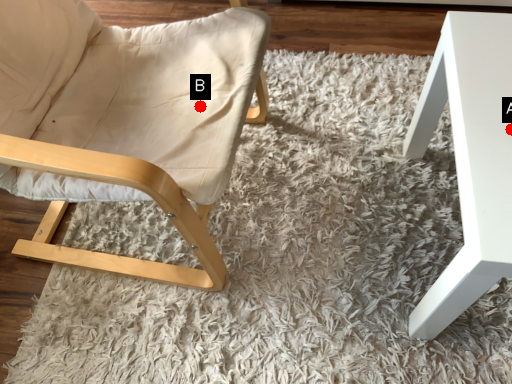
Question: Two points are circled on the image, labeled by A and B beside each circle. Which point is closer to the camera?

Choices:
 (A) A is closer
 (B) B is closer

Answer: (A)